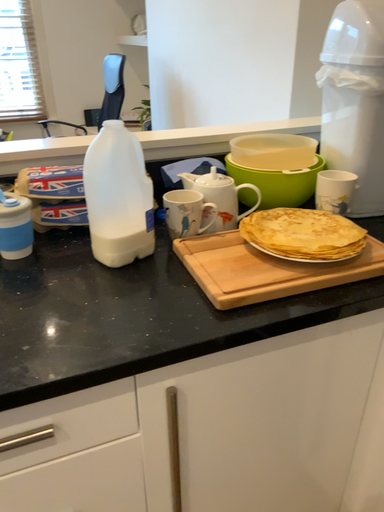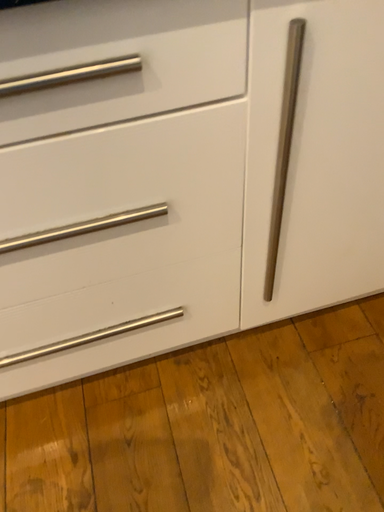
Question: How did the camera likely rotate when shooting the video?

Choices:
 (A) rotated left
 (B) rotated right

Answer: (A)